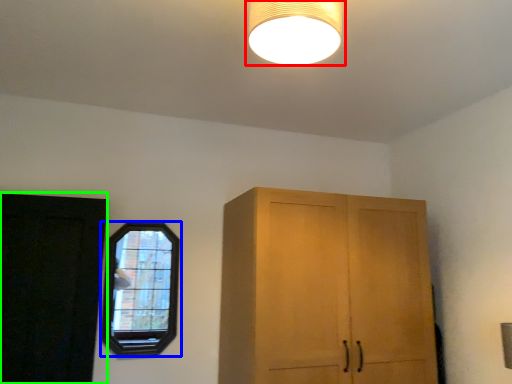
Question: Estimate the real-world distances between objects in this image. Which object is farther from lamp (highlighted by a red box), window (highlighted by a blue box) or door (highlighted by a green box)?

Choices:
 (A) window
 (B) door

Answer: (B)